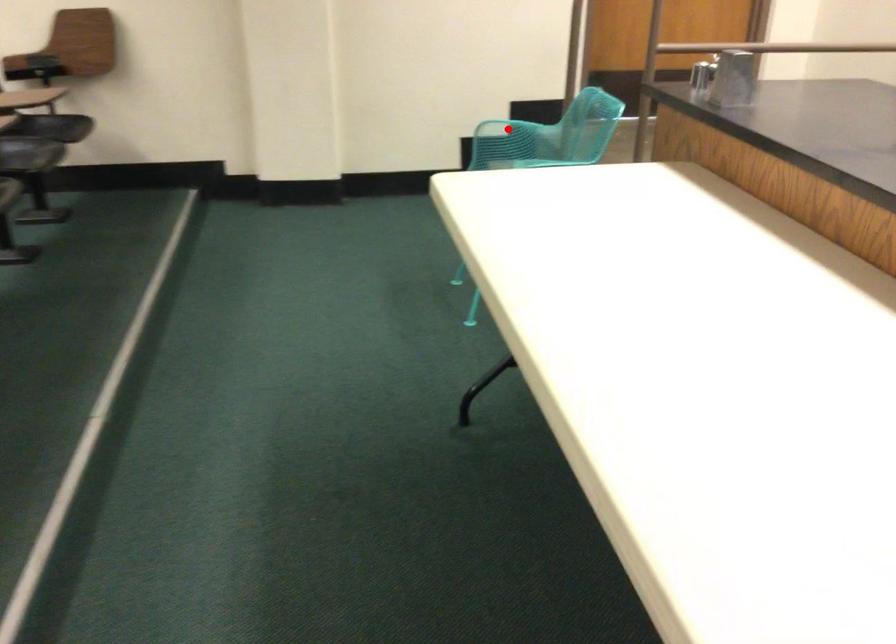
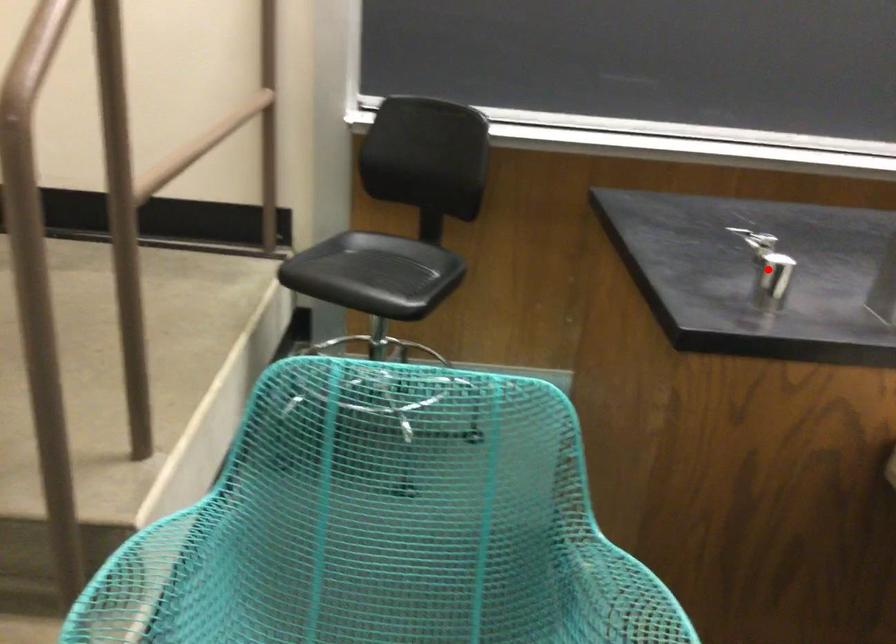
I am providing you with two images of the same scene from different viewpoints. A red point is marked on the first image and another point is marked on the second image. Is the marked point in image1 the same physical position as the marked point in image2?

No